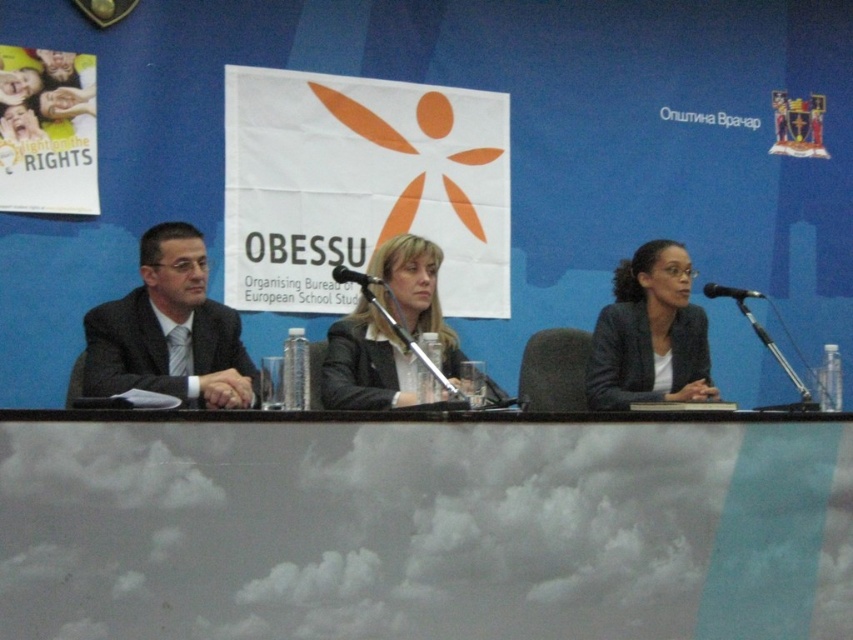
Question: Which object is closer to the camera taking this photo?

Choices:
 (A) black glossy suit at center
 (B) matte black blazer at right

Answer: (A)

Question: Which point is closer to the camera taking this photo?

Choices:
 (A) (345, 280)
 (B) (630, 282)
 (C) (368, 509)

Answer: (C)

Question: Can you confirm if dark suit at left is positioned below black metallic microphone at center?

Choices:
 (A) no
 (B) yes

Answer: (B)

Question: Does cloudy glass table at center have a larger size compared to matte black blazer at right?

Choices:
 (A) no
 (B) yes

Answer: (B)

Question: Is cloudy glass table at center positioned before dark suit at left?

Choices:
 (A) yes
 (B) no

Answer: (A)

Question: Which of these objects is positioned closest to the black metallic microphone at center?

Choices:
 (A) black glossy suit at center
 (B) dark suit at left
 (C) cloudy glass table at center

Answer: (A)